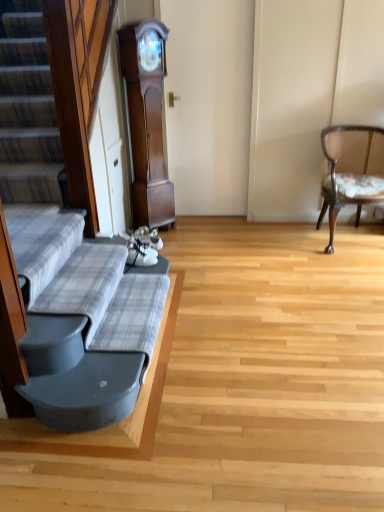
Question: Should I look upward or downward to see plaid fabric couch at left?

Choices:
 (A) down
 (B) up

Answer: (A)

Question: Is dark wood grandfather clock at center not close to wooden upholstered chair at right?

Choices:
 (A) no
 (B) yes

Answer: (B)

Question: Does dark wood grandfather clock at center have a smaller size compared to wooden upholstered chair at right?

Choices:
 (A) no
 (B) yes

Answer: (B)

Question: Does dark wood grandfather clock at center have a lesser width compared to wooden upholstered chair at right?

Choices:
 (A) no
 (B) yes

Answer: (B)

Question: From the image's perspective, is dark wood grandfather clock at center beneath wooden upholstered chair at right?

Choices:
 (A) yes
 (B) no

Answer: (B)

Question: Can you see dark wood grandfather clock at center touching wooden upholstered chair at right?

Choices:
 (A) no
 (B) yes

Answer: (A)

Question: Can you confirm if dark wood grandfather clock at center is taller than wooden upholstered chair at right?

Choices:
 (A) no
 (B) yes

Answer: (B)

Question: Is dark wood grandfather clock at center taller than plaid fabric couch at left?

Choices:
 (A) yes
 (B) no

Answer: (A)

Question: From a real-world perspective, is dark wood grandfather clock at center located higher than plaid fabric couch at left?

Choices:
 (A) yes
 (B) no

Answer: (A)

Question: From the image's perspective, is dark wood grandfather clock at center located above plaid fabric couch at left?

Choices:
 (A) no
 (B) yes

Answer: (B)

Question: From a real-world perspective, is dark wood grandfather clock at center beneath plaid fabric couch at left?

Choices:
 (A) yes
 (B) no

Answer: (B)

Question: Is dark wood grandfather clock at center turned away from plaid fabric couch at left?

Choices:
 (A) no
 (B) yes

Answer: (A)

Question: Is dark wood grandfather clock at center thinner than plaid fabric couch at left?

Choices:
 (A) yes
 (B) no

Answer: (A)

Question: Considering the relative positions of wooden upholstered chair at right and plaid fabric couch at left in the image provided, is wooden upholstered chair at right to the right of plaid fabric couch at left from the viewer's perspective?

Choices:
 (A) no
 (B) yes

Answer: (B)